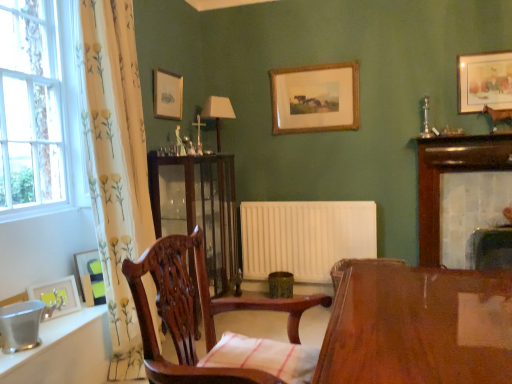
Locate an element on the screen. This screenshot has width=512, height=384. vacant region below gold-framed picture at upper center, the second picture frame positioned from the right (from a real-world perspective) is located at coordinates (312, 199).